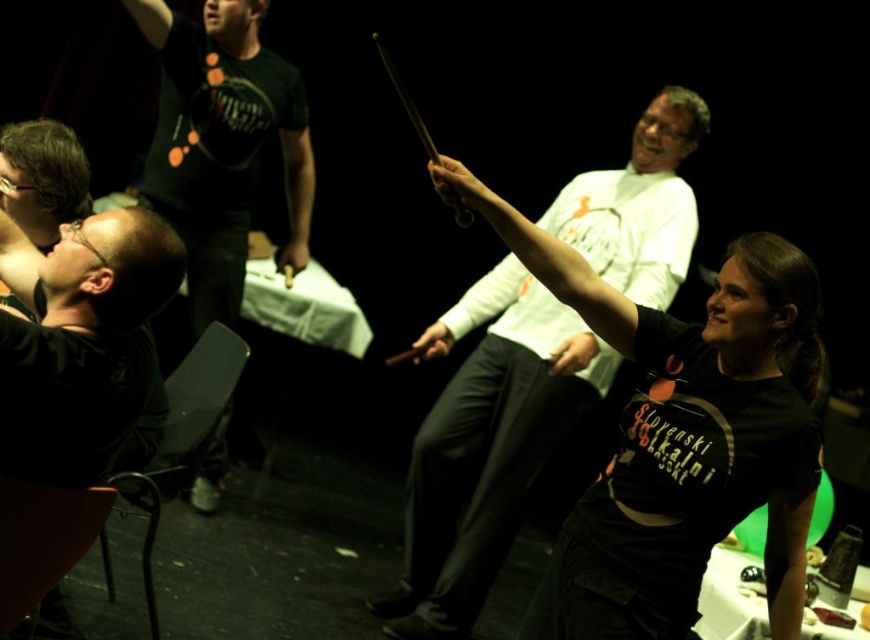
Question: Which object is farther from the camera taking this photo?

Choices:
 (A) black matte t-shirt at upper center
 (B) matte black shirt at upper left
 (C) matte black shirt at center
 (D) matte black shirt at left

Answer: (A)

Question: Can you confirm if black matte t-shirt at upper center is positioned to the left of matte black shirt at upper left?

Choices:
 (A) no
 (B) yes

Answer: (A)

Question: Does matte black shirt at center come behind matte black shirt at left?

Choices:
 (A) no
 (B) yes

Answer: (B)

Question: Which point is closer to the camera taking this photo?

Choices:
 (A) (21, 182)
 (B) (31, 284)

Answer: (B)

Question: Which of the following is the closest to the observer?

Choices:
 (A) black matte t-shirt at upper center
 (B) matte black shirt at left
 (C) matte black shirt at upper left
 (D) matte black shirt at center

Answer: (B)

Question: Is matte black shirt at center in front of black matte t-shirt at upper center?

Choices:
 (A) yes
 (B) no

Answer: (A)